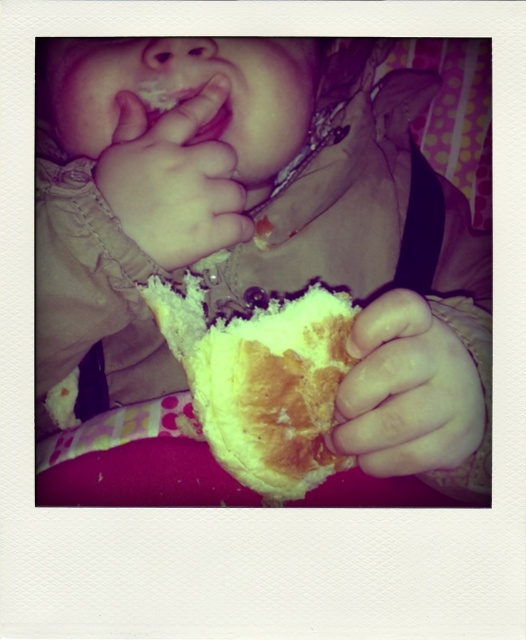
Which is more to the right, golden crusty bread at lower center or smooth white bread at lower right?

From the viewer's perspective, smooth white bread at lower right appears more on the right side.

Consider the image. Is golden crusty bread at lower center below smooth white bread at lower right?

No, golden crusty bread at lower center is not below smooth white bread at lower right.

The image size is (526, 640). What do you see at coordinates (261, 381) in the screenshot?
I see `golden crusty bread at lower center` at bounding box center [261, 381].

I want to click on golden crusty bread at lower center, so click(261, 381).

Where is `soft white bread at center`? soft white bread at center is located at coordinates (261, 230).

Can you confirm if soft white bread at center is wider than smooth beige hand at upper left?

Yes, soft white bread at center is wider than smooth beige hand at upper left.

Based on the photo, who is more forward, (x=369, y=189) or (x=104, y=180)?

Positioned in front is point (x=104, y=180).

Locate an element on the screen. soft white bread at center is located at coordinates (261, 230).

Who is taller, soft white bread at center or golden crusty bread at lower center?

soft white bread at center is taller.

Does point (406, 362) come closer to viewer compared to point (257, 388)?

Yes, it is.

You are a GUI agent. You are given a task and a screenshot of the screen. Output one action in this format:
    pyautogui.click(x=<x>, y=<y>)
    Task: Click on the soft white bread at center
    
    Given the screenshot: What is the action you would take?
    pyautogui.click(x=261, y=230)